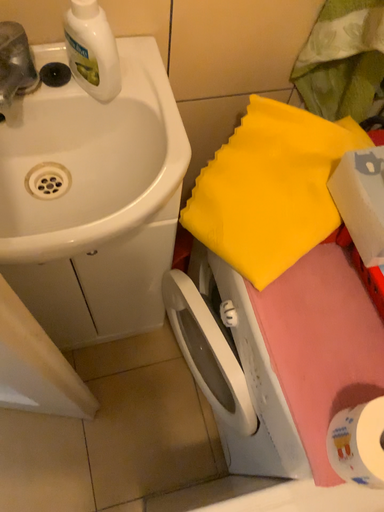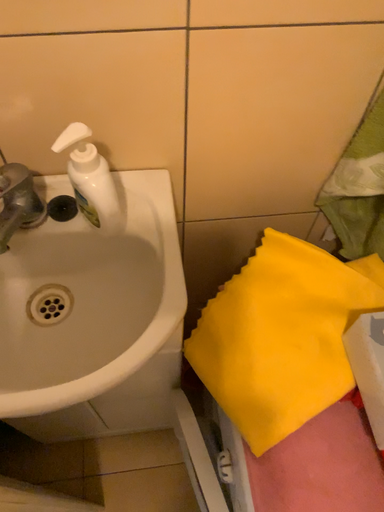
Question: How did the camera likely rotate when shooting the video?

Choices:
 (A) rotated downward
 (B) rotated upward

Answer: (B)